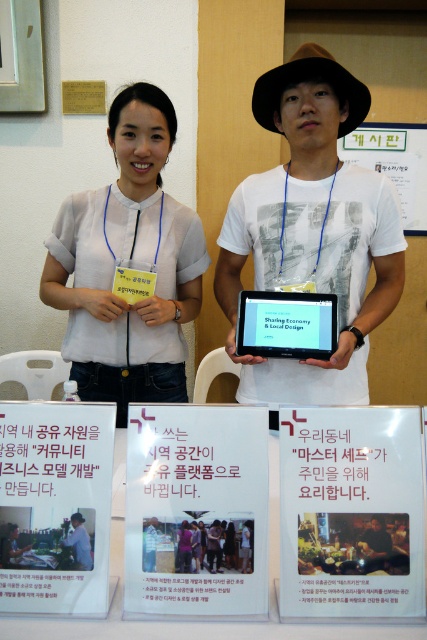
Is point (263, 276) less distant than point (313, 476)?

That is False.

Between white cotton t-shirt at center and white paper sign at center, which one has less height?

With less height is white paper sign at center.

Measure the distance between point (236, 193) and camera.

Point (236, 193) and camera are 1.62 meters apart from each other.

Find the location of a particular element. white cotton t-shirt at center is located at coordinates (312, 228).

Between point (292, 161) and point (371, 561), which one is positioned in front?

Point (371, 561) is more forward.

Does white cotton t-shirt at center have a smaller size compared to brown leather jacket at center?

Actually, white cotton t-shirt at center might be larger than brown leather jacket at center.

Is point (380, 200) closer to camera compared to point (383, 547)?

No, it is not.

Identify the location of white cotton t-shirt at center. (312, 228).

Does white cotton t-shirt at center have a smaller size compared to white paper poster at center?

No, white cotton t-shirt at center is not smaller than white paper poster at center.

Who is more forward, (298, 145) or (160, 524)?

Point (160, 524) is more forward.

Image resolution: width=427 pixels, height=640 pixels. I want to click on white cotton t-shirt at center, so click(312, 228).